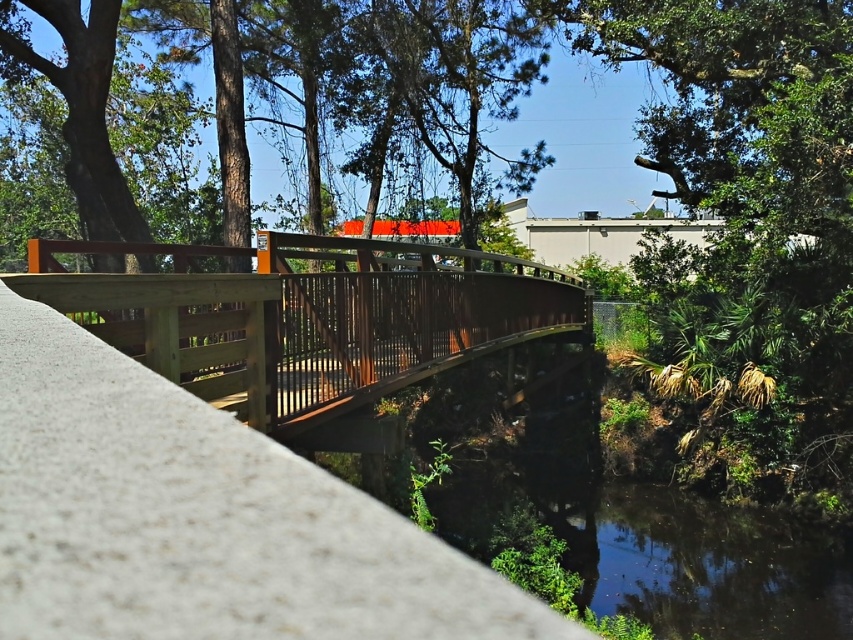
Between point (44, 484) and point (366, 241), which one is positioned in front?

Positioned in front is point (44, 484).

Between point (21, 472) and point (262, 326), which one is positioned in front?

Point (21, 472) is more forward.

This screenshot has width=853, height=640. I want to click on smooth concrete ledge at center, so click(x=199, y=516).